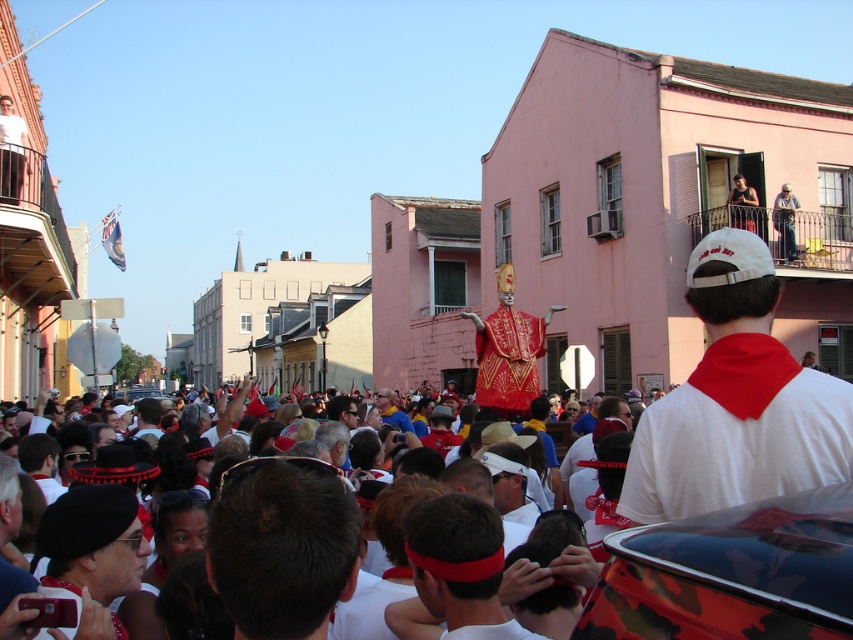
Question: Does camouflage-patterned car at center come in front of shiny gold statue at center?

Choices:
 (A) no
 (B) yes

Answer: (B)

Question: Which point is farther from the camera taking this photo?

Choices:
 (A) (744, 189)
 (B) (808, 502)
 (C) (706, 493)

Answer: (A)

Question: Can you confirm if white fabric at upper right is thinner than shiny gold statue at center?

Choices:
 (A) no
 (B) yes

Answer: (B)

Question: Which is farther from the dark brown leather jacket at upper right?

Choices:
 (A) white cotton shirt at upper right
 (B) white fabric at upper right
 (C) shiny gold statue at center

Answer: (B)

Question: Estimate the real-world distances between objects in this image. Which object is closer to the white cotton shirt at upper right?

Choices:
 (A) white cotton crowd at center
 (B) dark brown leather jacket at upper right
 (C) white fabric at upper right
 (D) camouflage-patterned car at center

Answer: (B)

Question: Is white cotton crowd at center behind shiny gold statue at center?

Choices:
 (A) no
 (B) yes

Answer: (A)